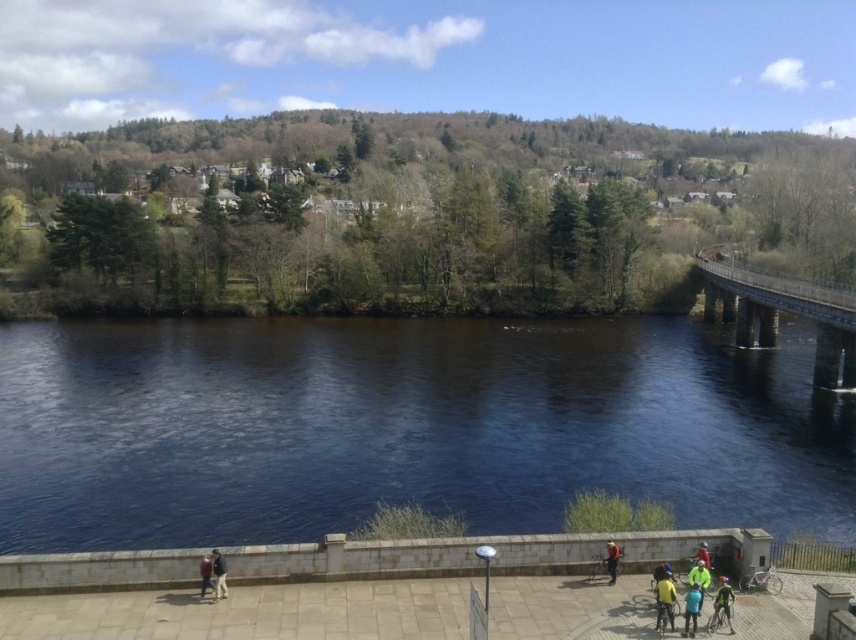
Question: Which of the following is the closest to the observer?

Choices:
 (A) yellow helmeted cyclist at lower center
 (B) green fabric jacket at lower center

Answer: (A)

Question: Is dark blue water at center bigger than green fabric jacket at lower right?

Choices:
 (A) yes
 (B) no

Answer: (A)

Question: Which object is farther from the camera taking this photo?

Choices:
 (A) green fabric jacket at lower right
 (B) green fabric jacket at lower center
 (C) yellow jacket at lower center

Answer: (B)

Question: Is yellow jacket at lower center thinner than dark blue jeans at lower left?

Choices:
 (A) yes
 (B) no

Answer: (B)

Question: From the image, what is the correct spatial relationship of stone bridge at upper right in relation to neon green jacket at lower right?

Choices:
 (A) left
 (B) right

Answer: (B)

Question: Estimate the real-world distances between objects in this image. Which object is closer to the yellow jacket at lower right?

Choices:
 (A) yellow fabric jacket at lower center
 (B) yellow jacket at lower center
 (C) dark blue water at center

Answer: (B)